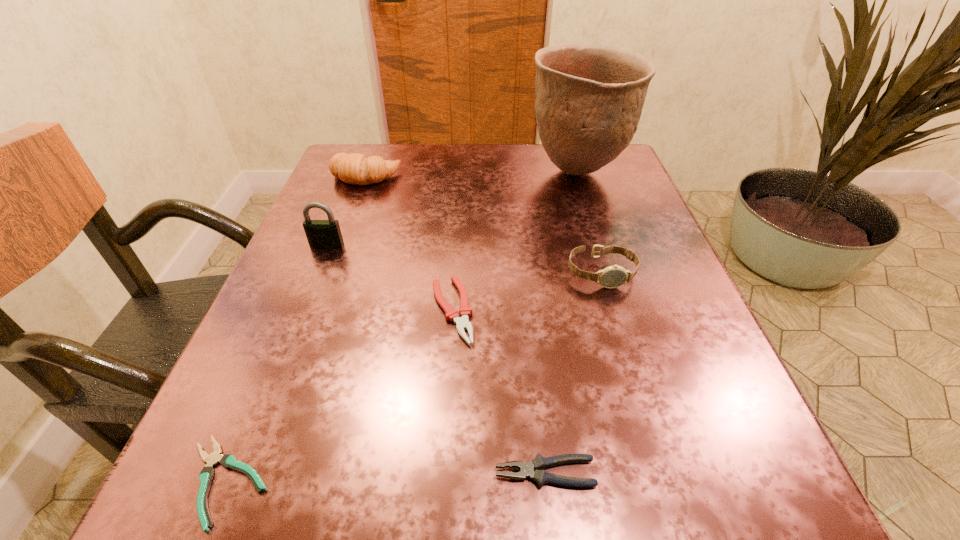
Where is `free space located 0.300m on the left of the pottery`? This screenshot has width=960, height=540. free space located 0.300m on the left of the pottery is located at coordinates (398, 172).

This screenshot has width=960, height=540. I want to click on free location located 0.240m on the front of the fifth nearest object, so pyautogui.click(x=284, y=353).

Where is `vacant point located on the front of the crescent roll`? The image size is (960, 540). vacant point located on the front of the crescent roll is located at coordinates (334, 261).

In order to click on vacant area situated 0.160m on the face of the fourth shortest object in this screenshot , I will do `click(629, 368)`.

This screenshot has height=540, width=960. Identify the location of vacant space located 0.100m at the gripping part of the rightmost pliers. (411, 473).

This screenshot has width=960, height=540. I want to click on free region located at the gripping part of the rightmost pliers, so click(x=377, y=473).

At what (x,y) coordinates should I click in order to perform the action: click on vacant area situated 0.260m at the gripping part of the rightmost pliers. Please return your answer as a coordinate pair (x, y). The width and height of the screenshot is (960, 540). Looking at the image, I should click on (276, 473).

Locate an element on the screen. The width and height of the screenshot is (960, 540). vacant space located on the right of the second pliers from left to right is located at coordinates (622, 310).

At what (x,y) coordinates should I click in order to perform the action: click on vacant space situated 0.190m on the right of the leftmost pliers. Please return your answer as a coordinate pair (x, y). The image size is (960, 540). Looking at the image, I should click on (433, 481).

Identify the location of pottery located in the far edge section of the desktop. The width and height of the screenshot is (960, 540). (589, 98).